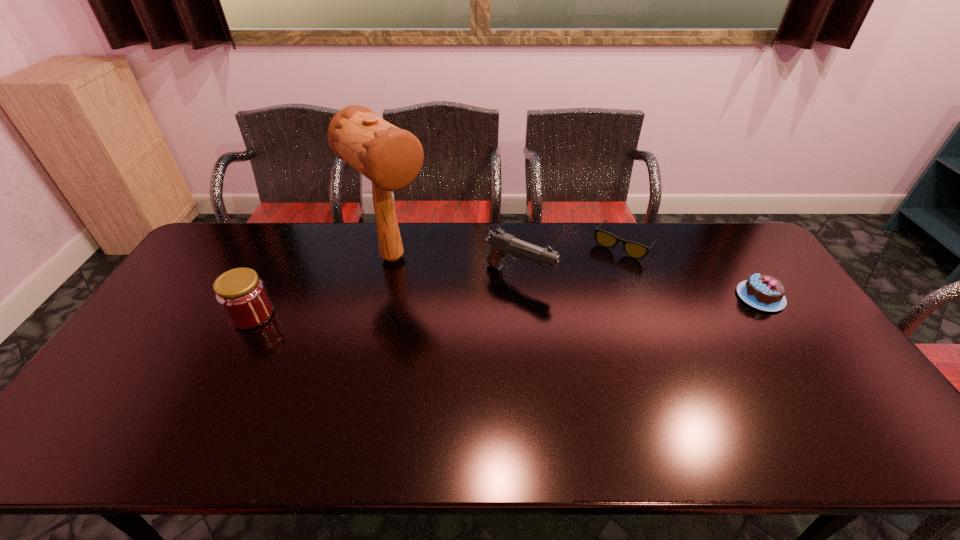
This screenshot has width=960, height=540. I want to click on the leftmost object, so click(241, 294).

At what (x,y) coordinates should I click in order to perform the action: click on the rightmost object. Please return your answer as a coordinate pair (x, y). Looking at the image, I should click on (761, 291).

You are a GUI agent. You are given a task and a screenshot of the screen. Output one action in this format:
    pyautogui.click(x=<x>, y=<y>)
    Task: Click on the second object from left to right
    This screenshot has width=960, height=540.
    Given the screenshot: What is the action you would take?
    pyautogui.click(x=390, y=157)

In order to click on mallet in this screenshot , I will do `click(390, 157)`.

Find the location of a particular element. the third object from right to left is located at coordinates (503, 244).

The width and height of the screenshot is (960, 540). I want to click on the shortest object, so click(634, 250).

Image resolution: width=960 pixels, height=540 pixels. Identify the location of sunglasses. (634, 250).

Locate an element on the screen. The width and height of the screenshot is (960, 540). blank space located on the left of the jam is located at coordinates (204, 315).

This screenshot has height=540, width=960. In order to click on vacant position located on the back of the rightmost object in this screenshot , I will do [x=715, y=230].

In order to click on vacant position located on the strike surface of the mallet in this screenshot , I will do `click(492, 346)`.